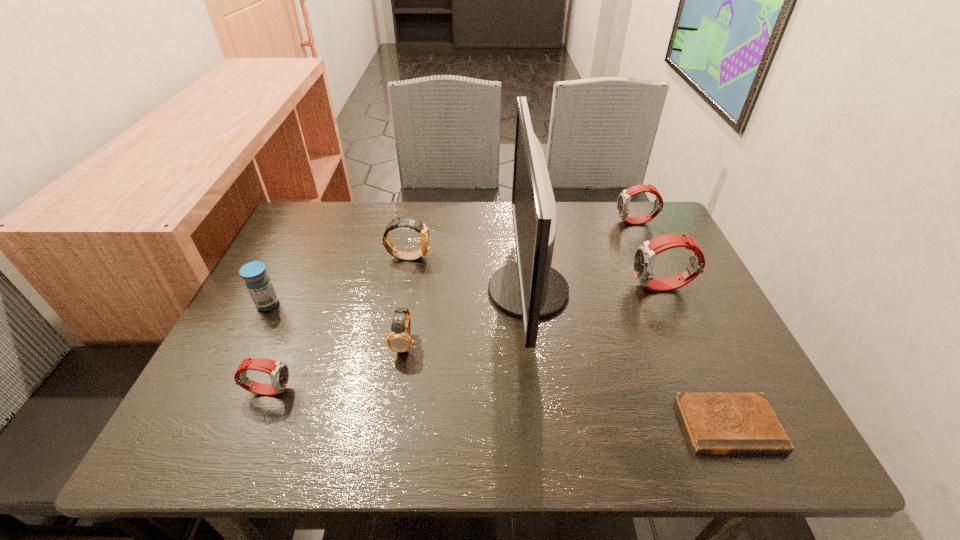
Locate an element on the screen. Image resolution: width=960 pixels, height=540 pixels. object positioned at the near edge is located at coordinates (717, 423).

Identify the location of medicine situated at the left edge. (257, 281).

Locate an element on the screen. watch that is at the left edge is located at coordinates (278, 371).

Where is `diary present at the right edge`? This screenshot has height=540, width=960. diary present at the right edge is located at coordinates (717, 423).

This screenshot has height=540, width=960. Find the location of `object positioned at the far right corner`. object positioned at the far right corner is located at coordinates (623, 203).

This screenshot has height=540, width=960. Identify the location of object located in the near right corner section of the desktop. (717, 423).

Identify the location of blank space at the far edge of the desktop. (389, 206).

I want to click on vacant space at the near edge of the desktop, so pyautogui.click(x=389, y=432).

Locate an element on the screen. vacant space at the left edge is located at coordinates (269, 265).

In the image, there is a desktop. Where is `free space at the far right corner`? free space at the far right corner is located at coordinates (652, 208).